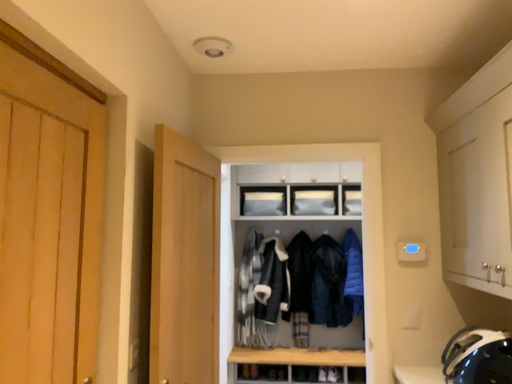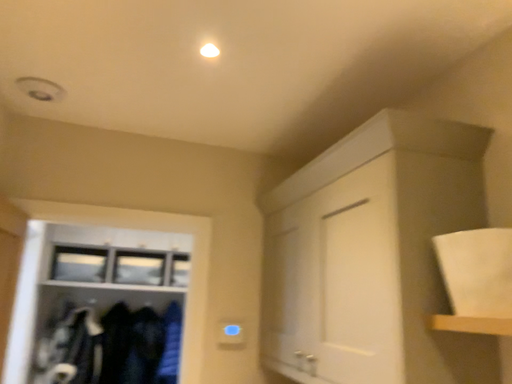
Question: Which way did the camera rotate in the video?

Choices:
 (A) rotated left
 (B) rotated right

Answer: (B)